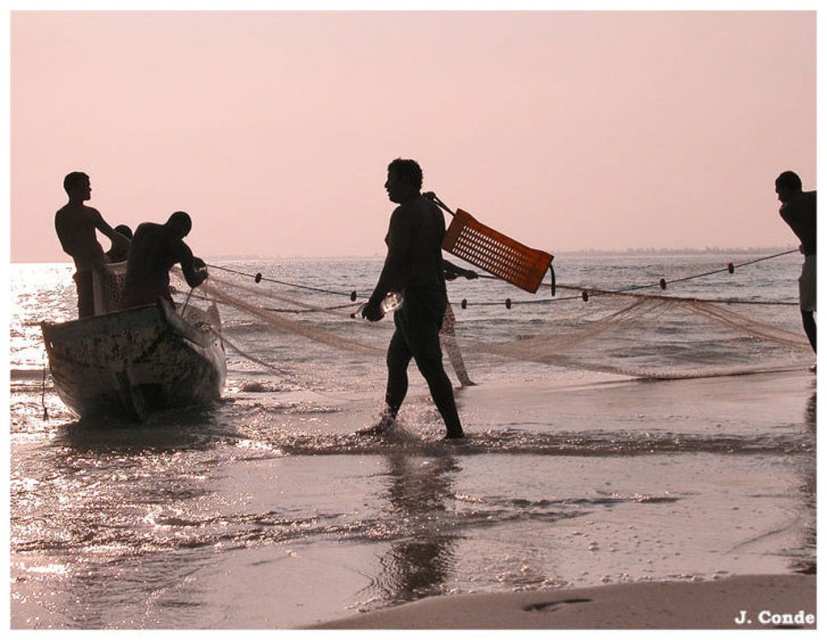
Question: Can you confirm if dark skin human at left is bigger than smooth skin man at right?

Choices:
 (A) no
 (B) yes

Answer: (A)

Question: Estimate the real-world distances between objects in this image. Which object is closer to the smooth skin man at right?

Choices:
 (A) translucent wet sand at lower center
 (B) smooth sand at lower center
 (C) dark skin human at left
 (D) rusty metal boat at lower left

Answer: (A)

Question: Is smooth sand at lower center positioned in front of smooth skin man at right?

Choices:
 (A) no
 (B) yes

Answer: (B)

Question: Which of the following is the farthest from the observer?

Choices:
 (A) dark skin human at left
 (B) dark matte wicker basket at center
 (C) translucent wet sand at lower center
 (D) smooth sand at lower center

Answer: (A)

Question: Which point is farther to the camera?

Choices:
 (A) (58, 241)
 (B) (801, 184)
 (C) (289, 400)
 (D) (141, 284)

Answer: (C)

Question: Is smooth sand at lower center smaller than dark matte wicker basket at center?

Choices:
 (A) no
 (B) yes

Answer: (B)